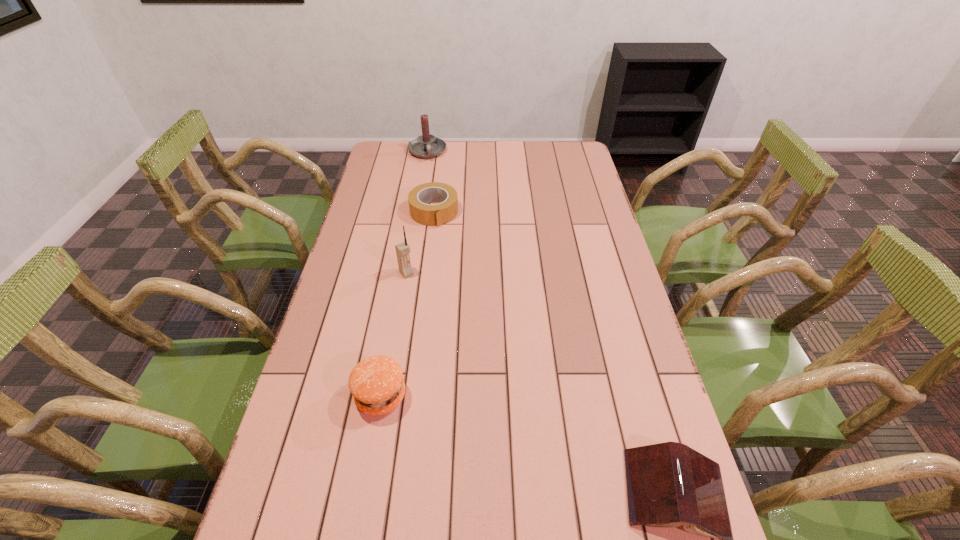
The height and width of the screenshot is (540, 960). What are the coordinates of `vacant spot on the desktop that is between the third shortest object and the book and is positioned at the edge of the duct tape` in the screenshot? It's located at (512, 440).

Identify the location of vacant space on the desktop that is between the patty and the book and is positioned on the front of the third nearest object, where the keypad is located. click(x=543, y=450).

Locate an element on the screen. The width and height of the screenshot is (960, 540). vacant space on the desktop that is between the patty and the nearest object and is positioned on the side of the farthest object with the handle loop is located at coordinates (491, 432).